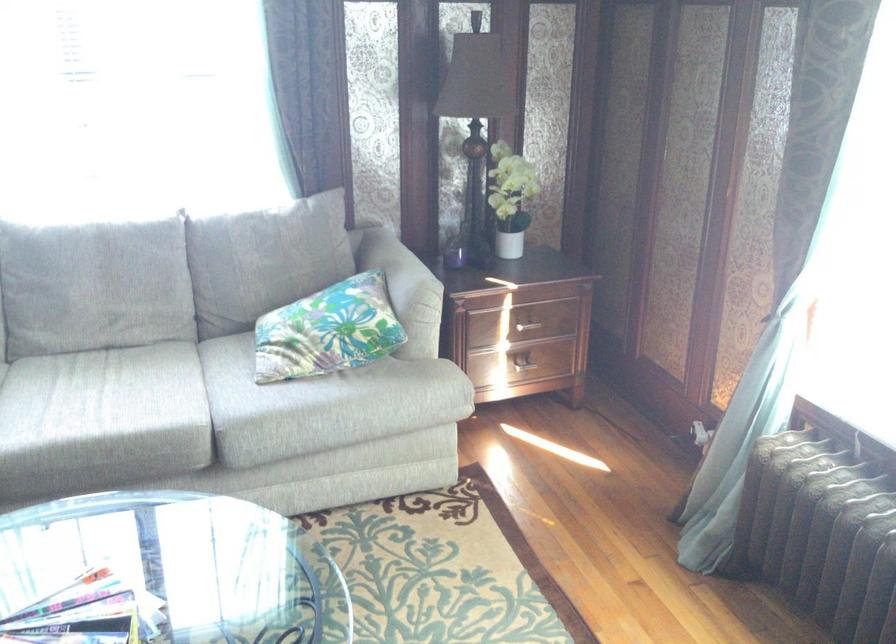
Find where to support the sofa armrest. Please return your answer as a coordinate pair (x, y).

(409, 279)